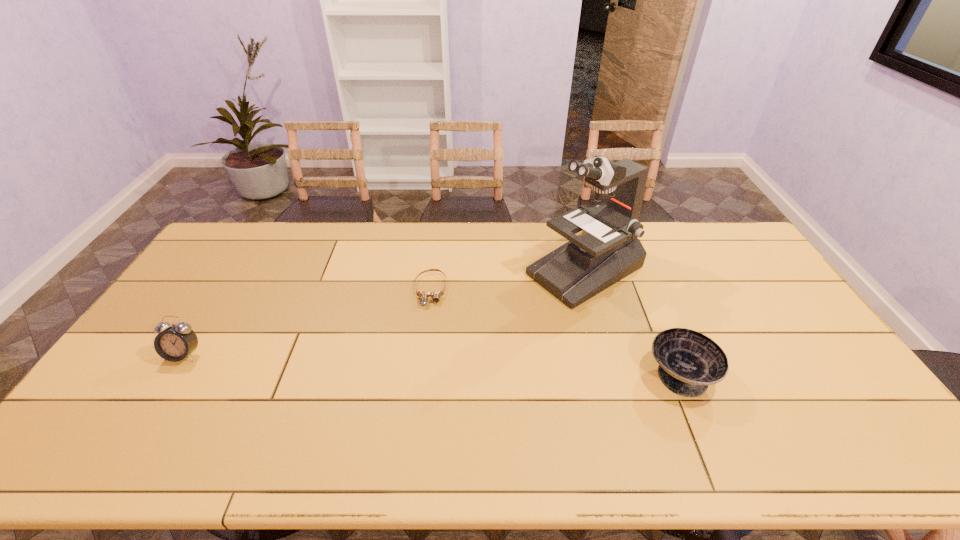
The width and height of the screenshot is (960, 540). What are the coordinates of `vacant area that lies between the goggles and the microscope` in the screenshot? It's located at (508, 280).

Where is `free space between the leftmost object and the tallest object`? free space between the leftmost object and the tallest object is located at coordinates (384, 313).

Identify which object is the nearest to the tallest object. Please provide its 2D coordinates. Your answer should be formatted as a tuple, i.e. [(x, y)], where the tuple contains the x and y coordinates of a point satisfying the conditions above.

[(689, 361)]

Image resolution: width=960 pixels, height=540 pixels. What are the coordinates of `object identified as the third closest to the tallest object` in the screenshot? It's located at (177, 342).

Locate an element on the screen. The image size is (960, 540). free space that satisfies the following two spatial constraints: 1. on the back side of the tallest object; 2. on the left side of the second object from left to right is located at coordinates (433, 270).